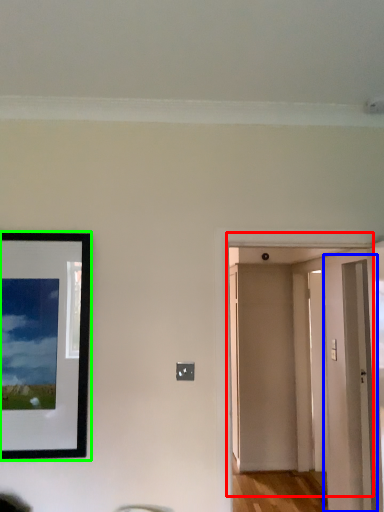
Question: Based on their relative distances, which object is nearer to door (highlighted by a red box)? Choose from glass door (highlighted by a blue box) and picture frame (highlighted by a green box).

Choices:
 (A) glass door
 (B) picture frame

Answer: (A)